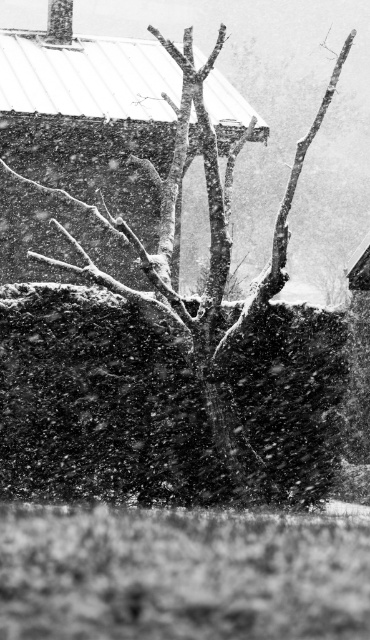
Can you confirm if smooth bark tree at center is thinner than smooth white snow at center?

Indeed, smooth bark tree at center has a lesser width compared to smooth white snow at center.

Can you confirm if smooth bark tree at center is shorter than smooth white snow at center?

No.

Is point (207, 324) in front of point (116, 132)?

Yes.

The width and height of the screenshot is (370, 640). Find the location of `smooth bark tree at center`. smooth bark tree at center is located at coordinates (230, 310).